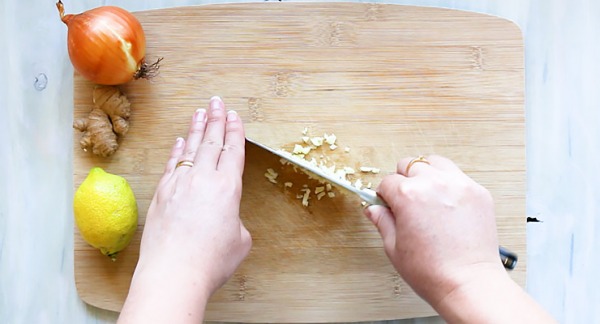
Identify the location of brown cutting board. (380, 91).